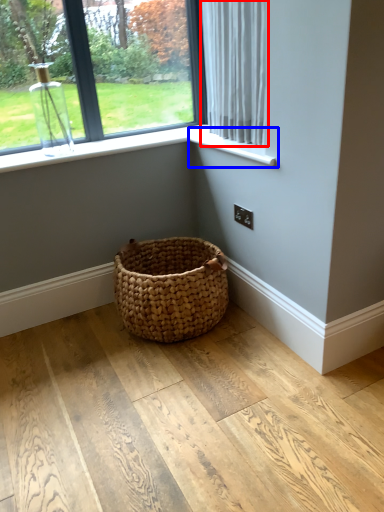
Question: Which of the following is the farthest to the observer, curtain (highlighted by a red box) or window sill (highlighted by a blue box)?

Choices:
 (A) curtain
 (B) window sill

Answer: (B)